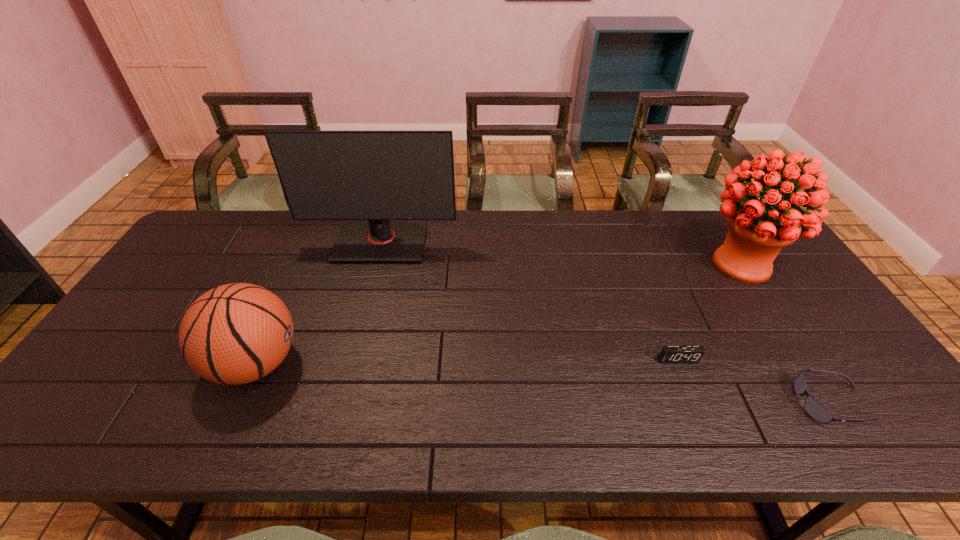
Where is `monitor`? monitor is located at coordinates (378, 176).

At what (x,y) coordinates should I click in order to perform the action: click on bouquet. Please return your answer as a coordinate pair (x, y). Image resolution: width=960 pixels, height=540 pixels. Looking at the image, I should click on (758, 230).

At what (x,y) coordinates should I click in order to perform the action: click on the third tallest object. Please return your answer as a coordinate pair (x, y). The width and height of the screenshot is (960, 540). Looking at the image, I should click on (233, 334).

In order to click on alarm clock in this screenshot , I will do `click(669, 354)`.

Identify the location of sunglasses. The height and width of the screenshot is (540, 960). (814, 409).

Find the location of a particular element. This screenshot has height=540, width=960. free point located 0.400m on the screen side of the monitor is located at coordinates pos(347,372).

Locate an element on the screen. This screenshot has width=960, height=540. vacant space located on the left of the bouquet is located at coordinates (623, 264).

Image resolution: width=960 pixels, height=540 pixels. I want to click on blank space located 0.190m on the side where the inflation valve is located, so click(x=379, y=363).

The width and height of the screenshot is (960, 540). I want to click on blank area located on the front-facing side of the alarm clock, so click(x=695, y=403).

At what (x,y) coordinates should I click in order to perform the action: click on free space located 0.180m on the lenses of the sunglasses. Please return your answer as a coordinate pair (x, y). Looking at the image, I should click on (720, 403).